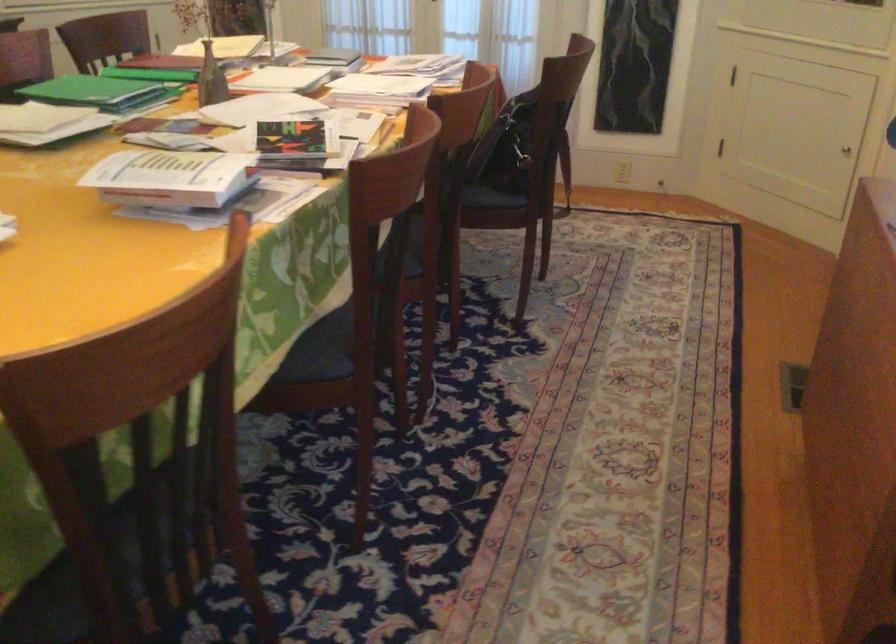
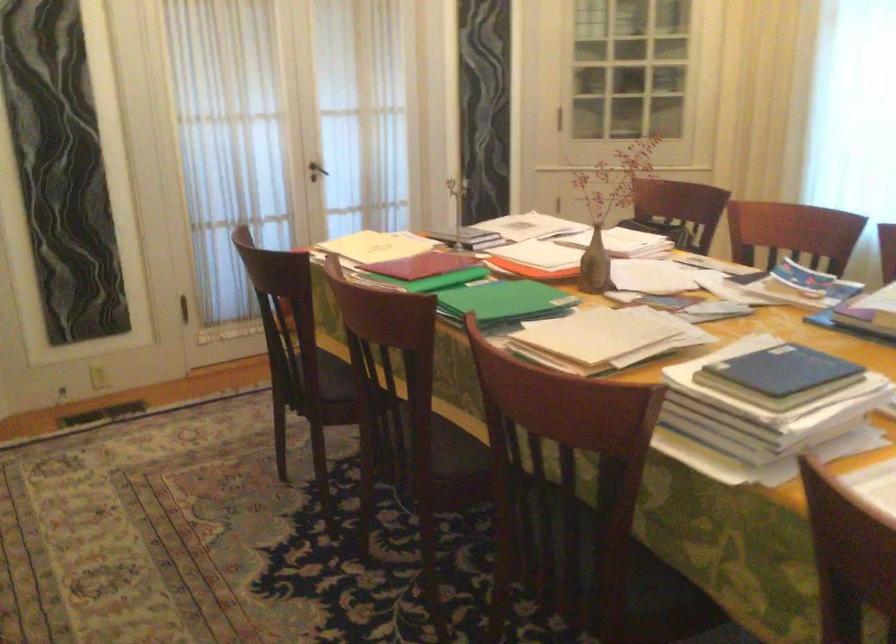
Question: I am providing you with two images of the same scene from different viewpoints. After the viewpoint changes to image2, which objects are now occluded?

Choices:
 (A) glass pot lid handle
 (B) yellow folder
 (C) dark door handle
 (D) chair sitting surface

Answer: (D)